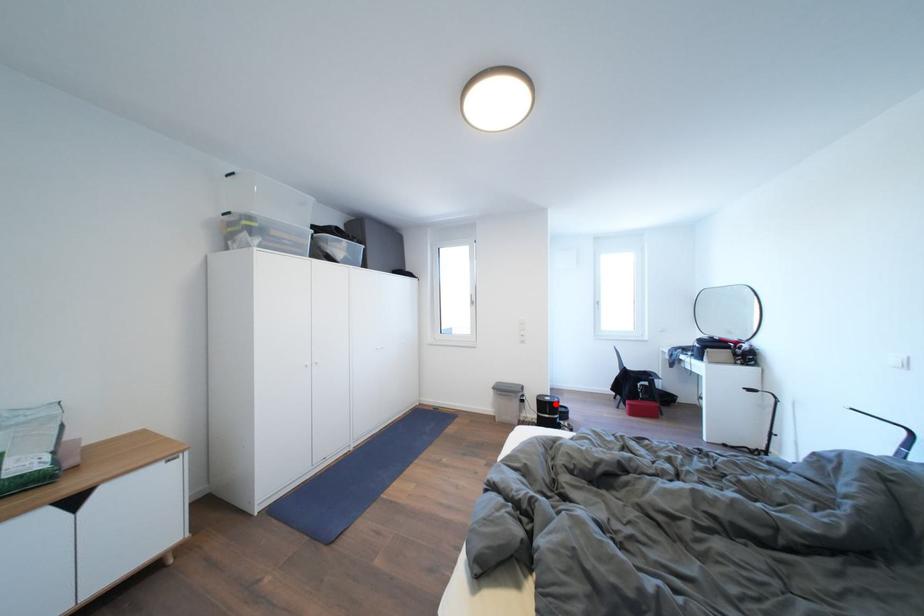
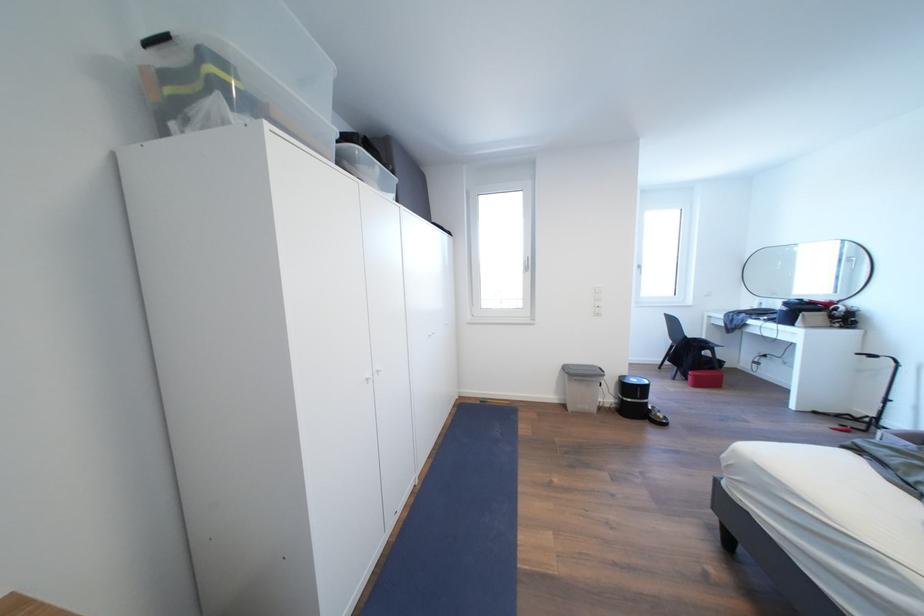
In the second image, find the point that corresponds to the highlighted location in the first image.

(641, 386)